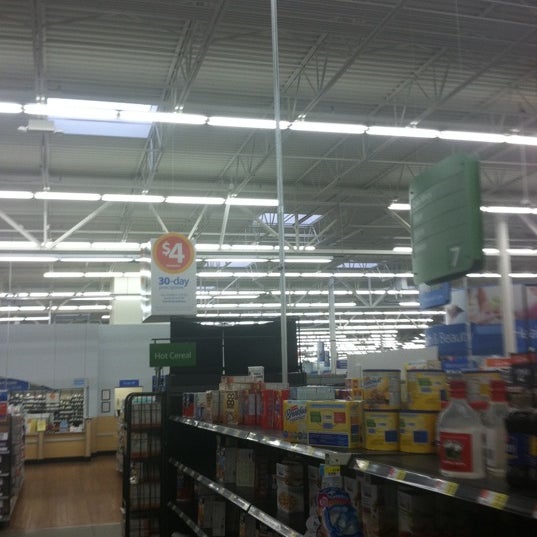
Find the location of `shelves`. shelves is located at coordinates (412, 478), (271, 509).